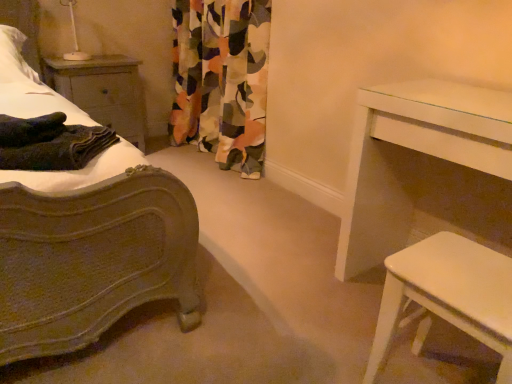
Question: Is wooden nightstand at left in front of or behind dark green textured blanket at left in the image?

Choices:
 (A) behind
 (B) front

Answer: (A)

Question: Is wooden nightstand at left spatially inside dark green textured blanket at left, or outside of it?

Choices:
 (A) outside
 (B) inside

Answer: (A)

Question: Estimate the real-world distances between objects in this image. Which object is farther from the white soft pillow at upper left?

Choices:
 (A) multicolored fabric curtain at center
 (B) white glossy stool at lower right, which appears as the 1th table when viewed from the front
 (C) white glossy table at right, the 2th table positioned from the front
 (D) dark green textured blanket at left
 (E) wooden nightstand at left

Answer: (B)

Question: Considering the real-world distances, which object is closest to the dark green textured blanket at left?

Choices:
 (A) white soft pillow at upper left
 (B) wooden nightstand at left
 (C) white glossy stool at lower right, the 2th table viewed from the back
 (D) multicolored fabric curtain at center
 (E) white glossy table at right, the 2th table positioned from the front

Answer: (A)